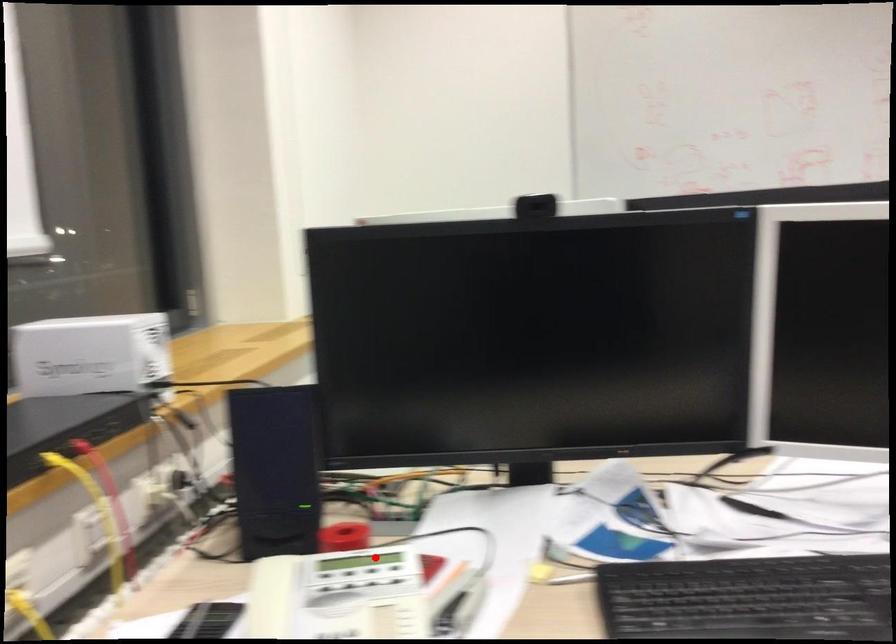
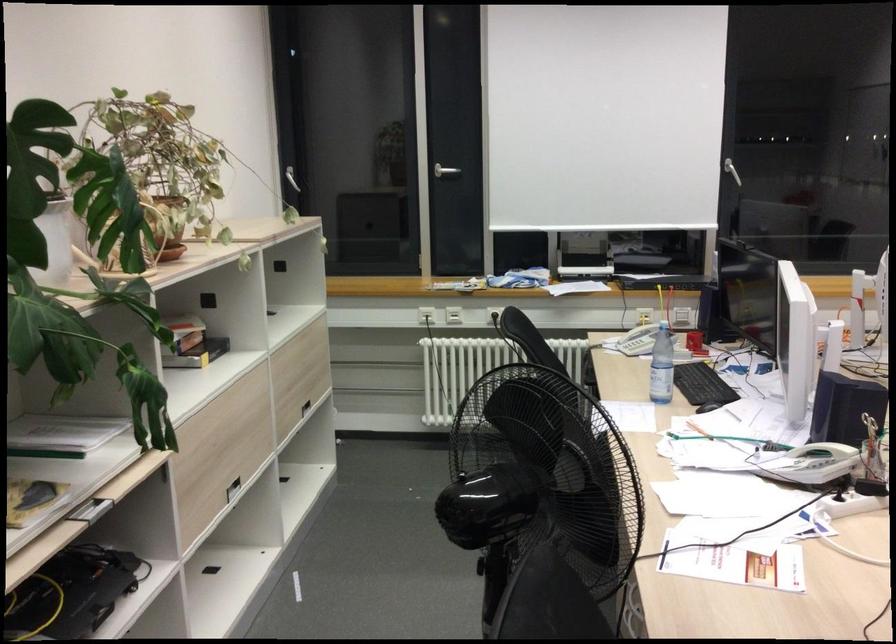
Question: I am providing you with two images of the same scene from different viewpoints. Given a red point in image1, look at the same physical point in image2. Is it:

Choices:
 (A) Closer to the viewpoint
 (B) Farther from the viewpoint

Answer: (B)